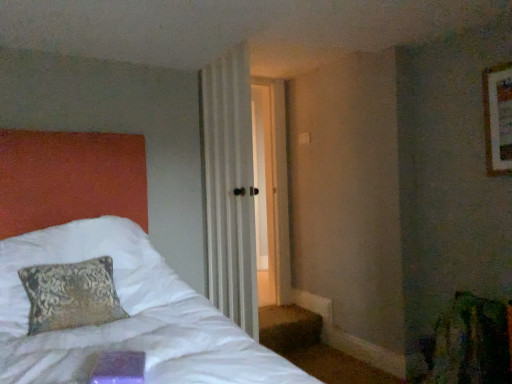
Question: Is white striped curtain at center positioned far away from wooden frame at upper right?

Choices:
 (A) no
 (B) yes

Answer: (B)

Question: Is white striped curtain at center closer to the viewer compared to wooden frame at upper right?

Choices:
 (A) no
 (B) yes

Answer: (A)

Question: Is white striped curtain at center to the right of wooden frame at upper right from the viewer's perspective?

Choices:
 (A) yes
 (B) no

Answer: (B)

Question: Could wooden frame at upper right be considered to be inside white striped curtain at center?

Choices:
 (A) no
 (B) yes

Answer: (A)

Question: Is white striped curtain at center smaller than wooden frame at upper right?

Choices:
 (A) yes
 (B) no

Answer: (B)

Question: Would you say white striped curtain at center is outside wooden frame at upper right?

Choices:
 (A) no
 (B) yes

Answer: (B)

Question: Can you confirm if wooden frame at upper right is thinner than white striped curtain at center?

Choices:
 (A) yes
 (B) no

Answer: (A)

Question: Does wooden frame at upper right appear on the right side of white striped curtain at center?

Choices:
 (A) yes
 (B) no

Answer: (A)

Question: From a real-world perspective, is wooden frame at upper right beneath white striped curtain at center?

Choices:
 (A) no
 (B) yes

Answer: (A)

Question: From the image's perspective, would you say wooden frame at upper right is shown under white striped curtain at center?

Choices:
 (A) yes
 (B) no

Answer: (B)

Question: Is wooden frame at upper right to the left of white striped curtain at center from the viewer's perspective?

Choices:
 (A) yes
 (B) no

Answer: (B)

Question: Is wooden frame at upper right oriented away from white striped curtain at center?

Choices:
 (A) yes
 (B) no

Answer: (B)

Question: Based on their sizes in the image, would you say white striped curtain at center is bigger or smaller than wooden frame at upper right?

Choices:
 (A) small
 (B) big

Answer: (B)